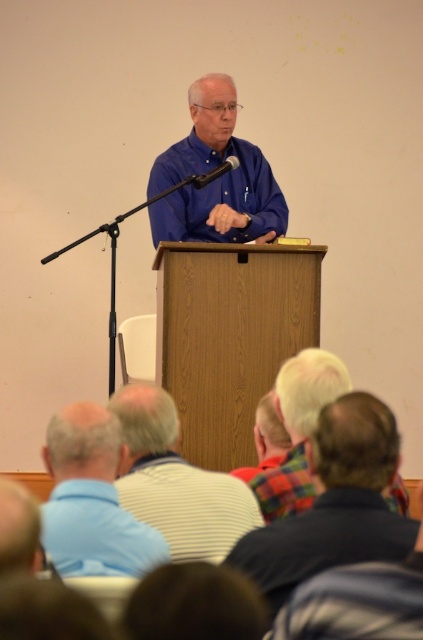
Can you confirm if matte blue shirt at center is wider than plaid fabric shirt at center?

Correct, the width of matte blue shirt at center exceeds that of plaid fabric shirt at center.

Is point (249, 150) less distant than point (301, 422)?

That is False.

Describe the element at coordinates (216, 179) in the screenshot. Image resolution: width=423 pixels, height=640 pixels. I see `matte blue shirt at center` at that location.

At what (x,y) coordinates should I click in order to perform the action: click on matte blue shirt at center. Please return your answer as a coordinate pair (x, y). This screenshot has width=423, height=640. Looking at the image, I should click on (216, 179).

You are a GUI agent. You are given a task and a screenshot of the screen. Output one action in this format:
    pyautogui.click(x=<x>, y=<y>)
    Task: Click on the striped shirt at lower center
    Image resolution: width=423 pixels, height=640 pixels.
    Given the screenshot: What is the action you would take?
    pyautogui.click(x=175, y=481)

Which is below, striped shirt at lower center or blue striped shirt at lower left?

blue striped shirt at lower left is below.

This screenshot has height=640, width=423. I want to click on striped shirt at lower center, so click(175, 481).

Is striped shirt at lower center thinner than matte blue shirt at center?

Yes, striped shirt at lower center is thinner than matte blue shirt at center.

Identify the location of striped shirt at lower center. Image resolution: width=423 pixels, height=640 pixels. 175,481.

Who is more forward, (236, 499) or (203, 225)?

Point (236, 499)

At what (x,y) coordinates should I click in order to perform the action: click on striped shirt at lower center. Please return your answer as a coordinate pair (x, y). The image size is (423, 640). Looking at the image, I should click on (175, 481).